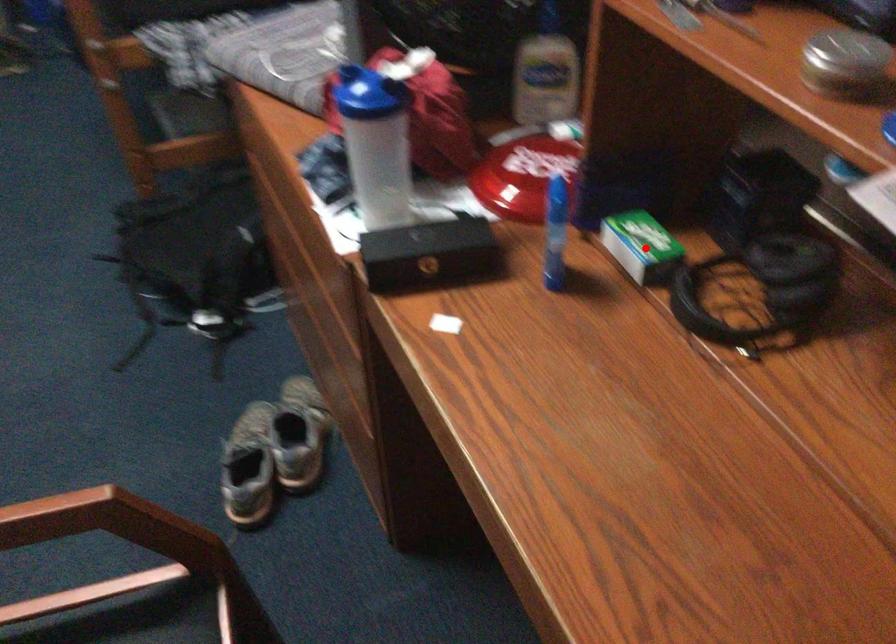
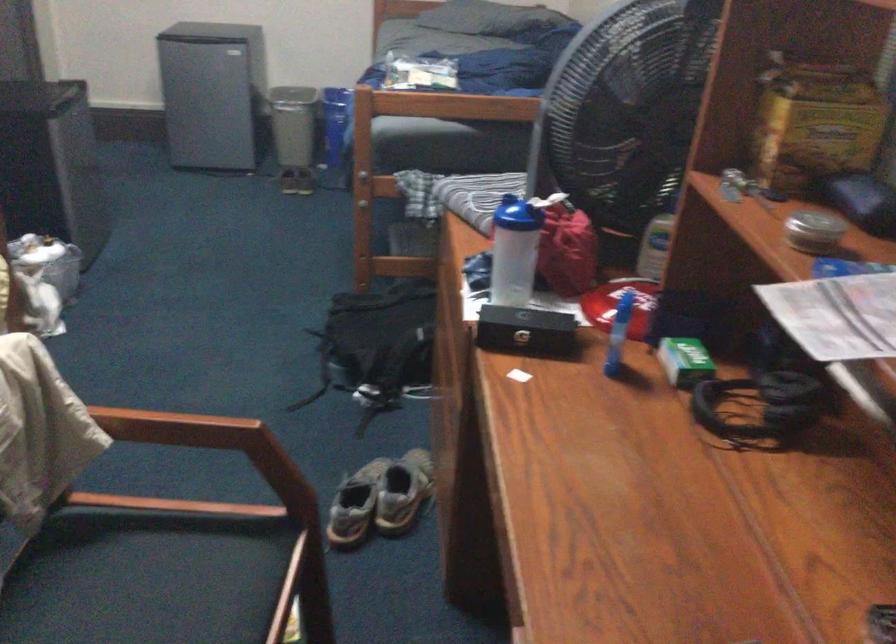
Where in the second image is the point corresponding to the highlighted location from the first image?

(685, 361)